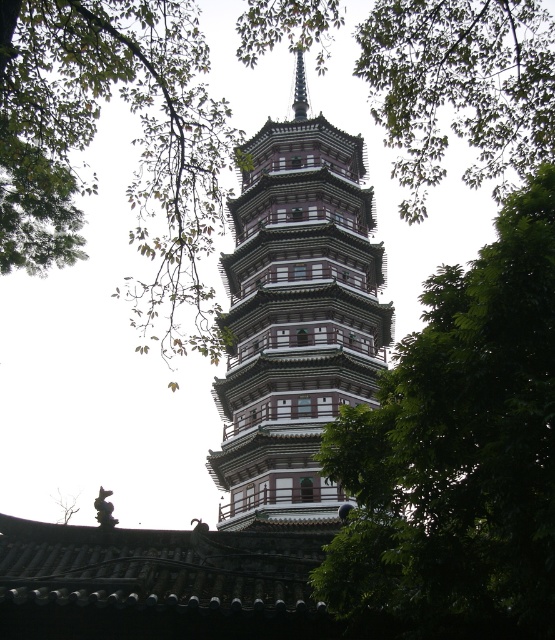
Does green leafy tree at center have a larger size compared to white wood tower at center?

Incorrect, green leafy tree at center is not larger than white wood tower at center.

Which is in front, point (421, 620) or point (230, 515)?

Point (421, 620)

Between point (516, 230) and point (361, 289), which one is positioned behind?

Point (361, 289)

Where is `green leafy tree at center`? green leafy tree at center is located at coordinates (457, 452).